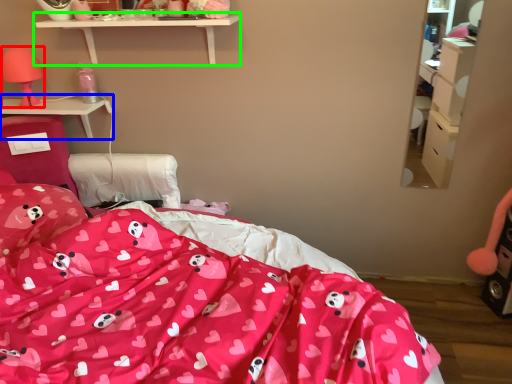
Question: Estimate the real-world distances between objects in this image. Which object is closer to table lamp (highlighted by a red box), desk (highlighted by a blue box) or shelf (highlighted by a green box)?

Choices:
 (A) desk
 (B) shelf

Answer: (A)